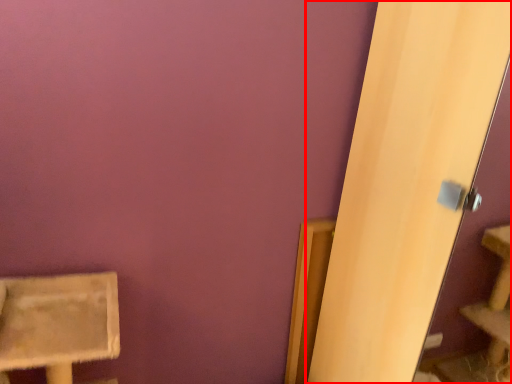
Question: From the image, what is the correct spatial relationship of screen door (annotated by the red box) in relation to furniture?

Choices:
 (A) right
 (B) left

Answer: (A)